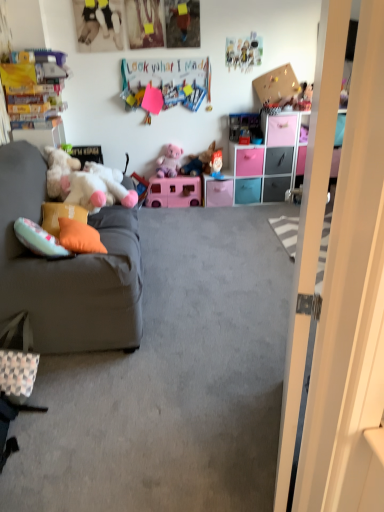
Question: Is white glossy door at right thinner than plush purple teddy bear at center?

Choices:
 (A) yes
 (B) no

Answer: (A)

Question: Is white glossy door at right behind plush purple teddy bear at center?

Choices:
 (A) yes
 (B) no

Answer: (B)

Question: Can you see white glossy door at right touching plush purple teddy bear at center?

Choices:
 (A) yes
 (B) no

Answer: (B)

Question: Can you confirm if white glossy door at right is smaller than plush purple teddy bear at center?

Choices:
 (A) yes
 (B) no

Answer: (B)

Question: Can we say white glossy door at right lies outside plush purple teddy bear at center?

Choices:
 (A) yes
 (B) no

Answer: (A)

Question: Is white glossy door at right surrounding plush purple teddy bear at center?

Choices:
 (A) yes
 (B) no

Answer: (B)

Question: Is pink plastic drawer at center, placed as the 4th drawer when sorted from left to right, smaller than orange fabric pillow at left, the 2th pillow positioned from the front?

Choices:
 (A) yes
 (B) no

Answer: (B)

Question: Does pink plastic drawer at center, the third drawer from the right, contain orange fabric pillow at left, the 2th pillow positioned from the front?

Choices:
 (A) yes
 (B) no

Answer: (B)

Question: From the image's perspective, is pink plastic drawer at center, placed as the 4th drawer when sorted from left to right, under orange fabric pillow at left, which is the first pillow from back to front?

Choices:
 (A) yes
 (B) no

Answer: (B)

Question: Can you see pink plastic drawer at center, the third drawer from the right, touching orange fabric pillow at left, the 2th pillow positioned from the front?

Choices:
 (A) yes
 (B) no

Answer: (B)

Question: Does pink plastic drawer at center, the third drawer from the right, turn towards orange fabric pillow at left, which is the first pillow from back to front?

Choices:
 (A) yes
 (B) no

Answer: (B)

Question: Considering the relative sizes of pink plastic drawer at center, placed as the 4th drawer when sorted from left to right, and orange fabric pillow at left, which is the first pillow from back to front, in the image provided, is pink plastic drawer at center, placed as the 4th drawer when sorted from left to right, thinner than orange fabric pillow at left, which is the first pillow from back to front,?

Choices:
 (A) yes
 (B) no

Answer: (B)

Question: Can you confirm if pink plastic drawer at center, the third drawer from the right, is positioned to the right of blue fabric doll at center, the third toy when ordered from right to left?

Choices:
 (A) yes
 (B) no

Answer: (A)